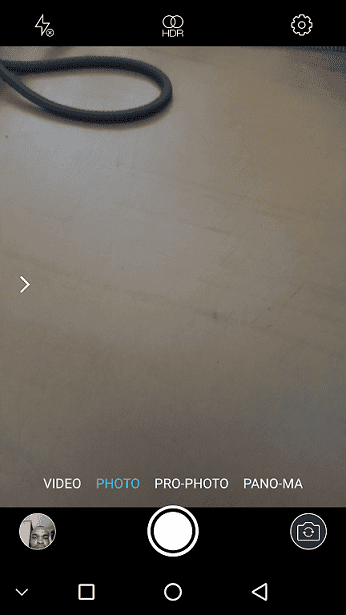
The image size is (346, 615). I want to click on cable, so click(x=94, y=113).